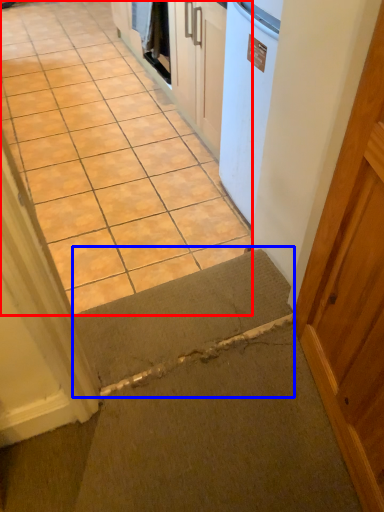
Question: Which point is closer to the camera, concrete (highlighted by a red box) or doormat (highlighted by a blue box)?

Choices:
 (A) concrete
 (B) doormat

Answer: (B)